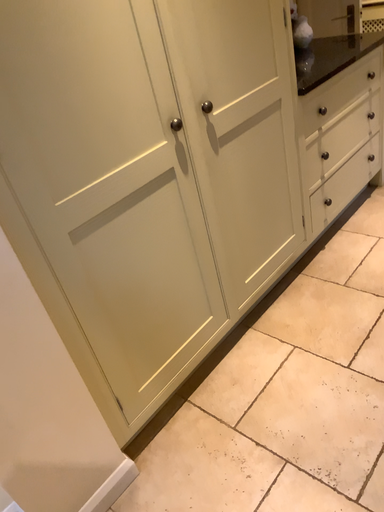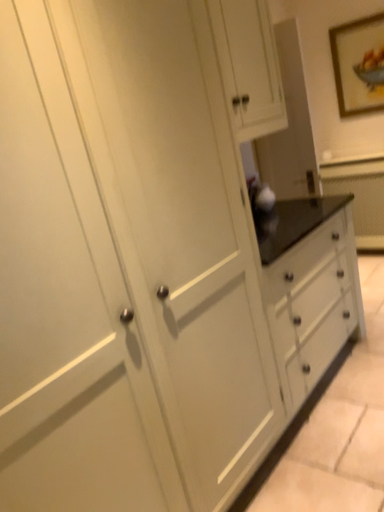
Question: How did the camera likely rotate when shooting the video?

Choices:
 (A) rotated downward
 (B) rotated upward

Answer: (B)